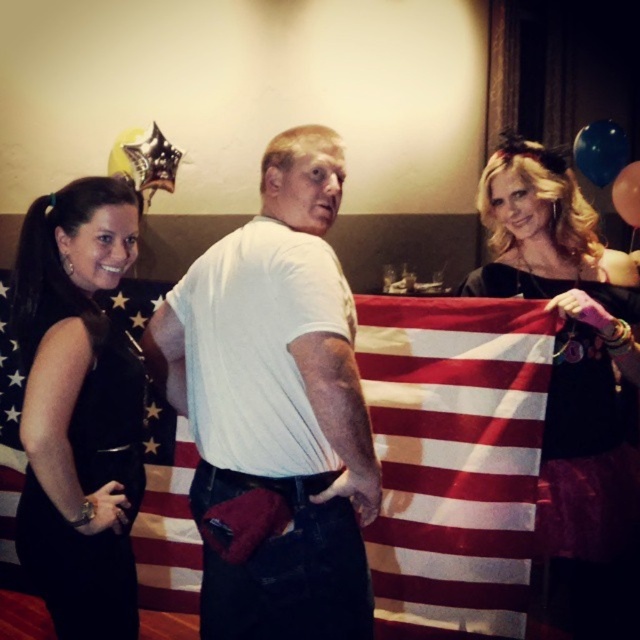
Question: Which point is farther to the camera?

Choices:
 (A) (625, 204)
 (B) (250, 548)

Answer: (A)

Question: Among these objects, which one is nearest to the camera?

Choices:
 (A) blue glossy balloon at upper right
 (B) white matte t-shirt at center

Answer: (B)

Question: Which point is farther to the camera?

Choices:
 (A) (61, 337)
 (B) (257, 230)
 (C) (573, 161)
 (D) (124, 157)

Answer: (C)

Question: Can you confirm if white matte t-shirt at center is bigger than rubber balloon at upper right?

Choices:
 (A) yes
 (B) no

Answer: (A)

Question: Does white matte t-shirt at center have a lesser width compared to metallic gold star at upper left?

Choices:
 (A) no
 (B) yes

Answer: (A)

Question: Observing the image, what is the correct spatial positioning of blue glossy balloon at upper right in reference to metallic gold star at upper left?

Choices:
 (A) above
 (B) below

Answer: (A)